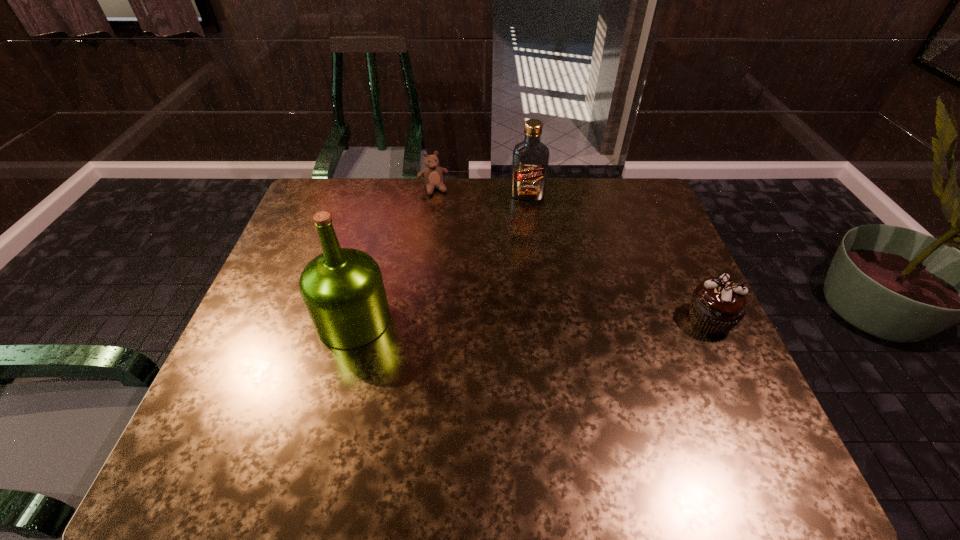
This screenshot has height=540, width=960. I want to click on olive oil, so click(x=343, y=291).

You are a GUI agent. You are given a task and a screenshot of the screen. Output one action in this format:
    pyautogui.click(x=<x>, y=<y>)
    Task: Click on the leftmost object
    The height and width of the screenshot is (540, 960).
    Given the screenshot: What is the action you would take?
    pyautogui.click(x=343, y=291)

Where is `the rightmost object`? The width and height of the screenshot is (960, 540). the rightmost object is located at coordinates (717, 305).

Where is `teddy bear`? This screenshot has width=960, height=540. teddy bear is located at coordinates (432, 175).

Where is `the second object from right to left`? This screenshot has height=540, width=960. the second object from right to left is located at coordinates (530, 161).

The image size is (960, 540). I want to click on vodka, so click(x=530, y=161).

The height and width of the screenshot is (540, 960). In order to click on vacant position located on the back of the leftmost object in this screenshot , I will do `click(366, 272)`.

Where is `vacant space located on the back of the cupcake`? This screenshot has width=960, height=540. vacant space located on the back of the cupcake is located at coordinates (678, 252).

This screenshot has height=540, width=960. In order to click on free region located 0.390m on the front-facing side of the third object from right to left in this screenshot , I will do `click(471, 275)`.

You are a GUI agent. You are given a task and a screenshot of the screen. Output one action in this format:
    pyautogui.click(x=<x>, y=<y>)
    Task: Click on the free spot located on the front-facing side of the third object from right to left
    This screenshot has height=540, width=960.
    Given the screenshot: What is the action you would take?
    pyautogui.click(x=456, y=241)